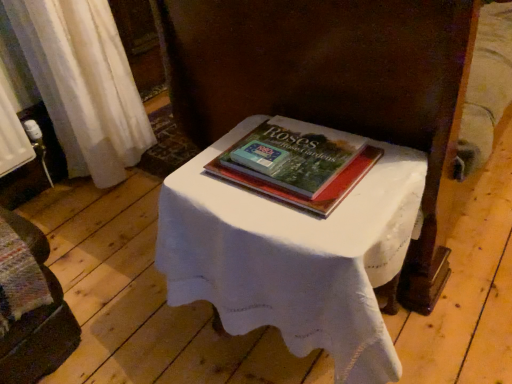
Where is `free space that is to the left of white cloth-covered table at center`? free space that is to the left of white cloth-covered table at center is located at coordinates (133, 308).